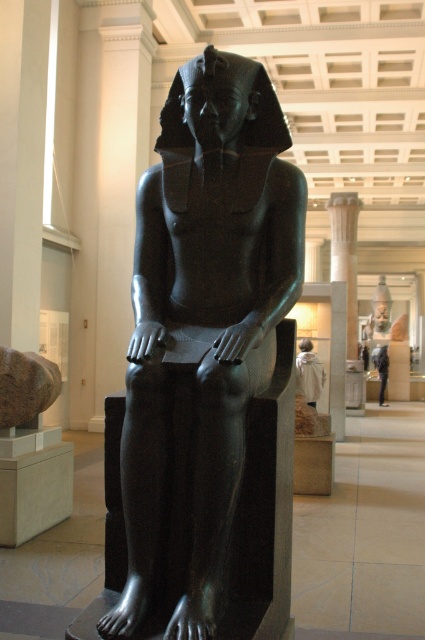
Is polished black statue at center wider than white cotton shirt at center?

Correct, the width of polished black statue at center exceeds that of white cotton shirt at center.

You are a GUI agent. You are given a task and a screenshot of the screen. Output one action in this format:
    pyautogui.click(x=<x>, y=<y>)
    Task: Click on the polished black statue at center
    
    Given the screenshot: What is the action you would take?
    pyautogui.click(x=204, y=317)

Between polished black statue at center and light blue fabric at center, which one is positioned higher?

Positioned higher is polished black statue at center.

How far apart are polished black statue at center and light blue fabric at center?

polished black statue at center and light blue fabric at center are 19.66 meters apart.

Between point (167, 289) and point (376, 364), which one is positioned behind?

Point (376, 364)

Where is `polished black statue at center`? polished black statue at center is located at coordinates (204, 317).

Is the position of white cotton shirt at center less distant than that of light blue fabric at center?

Yes.

Looking at this image, who is more forward, (303, 355) or (385, 365)?

Point (303, 355) is in front.

In order to click on white cotton shirt at center in this screenshot , I will do `click(308, 372)`.

You are a GUI agent. You are given a task and a screenshot of the screen. Output one action in this format:
    pyautogui.click(x=<x>, y=<y>)
    Task: Click on the white cotton shirt at center
    The image size is (425, 640).
    Given the screenshot: What is the action you would take?
    pyautogui.click(x=308, y=372)